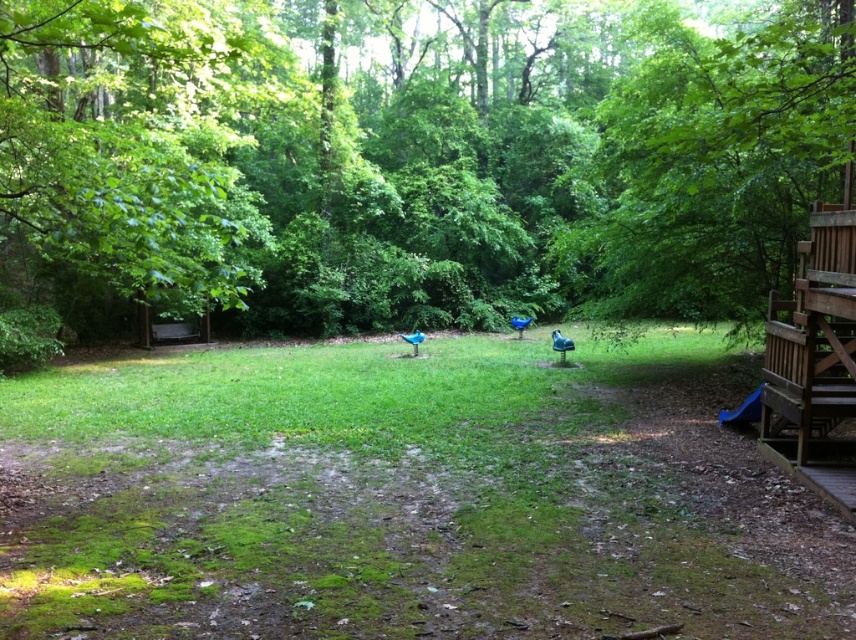
Question: Does green grass at center have a greater width compared to green matte bird at center?

Choices:
 (A) no
 (B) yes

Answer: (B)

Question: Which point is farther to the camera?

Choices:
 (A) green leafy tree at center
 (B) blue glossy bird at center
 (C) green grass at center
 (D) blue glossy statue at center

Answer: (D)

Question: Which point appears farthest from the camera in this image?

Choices:
 (A) (90, 33)
 (B) (531, 317)
 (C) (553, 349)
 (D) (795, 333)

Answer: (B)

Question: In this image, where is green leafy tree at center located relative to blue glossy statue at center?

Choices:
 (A) below
 (B) above

Answer: (B)

Question: Among these points, which one is nearest to the camera?

Choices:
 (A) (415, 339)
 (B) (795, 451)
 (C) (532, 316)
 (D) (554, 339)

Answer: (B)

Question: Is the position of green matte bird at center less distant than that of blue glossy statue at center?

Choices:
 (A) yes
 (B) no

Answer: (A)